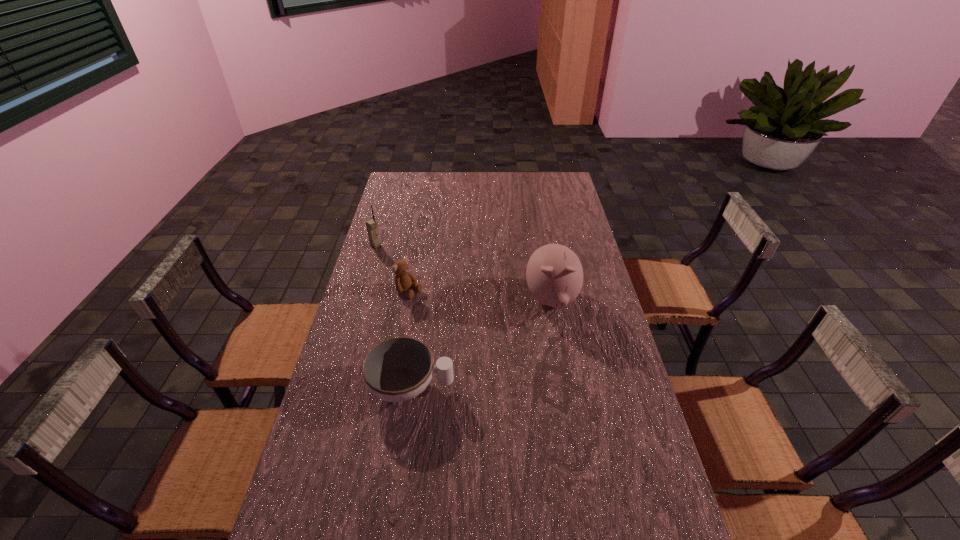
Where is `vacant space at the left edge`? The height and width of the screenshot is (540, 960). vacant space at the left edge is located at coordinates (354, 373).

This screenshot has width=960, height=540. I want to click on vacant area at the right edge of the desktop, so click(564, 226).

This screenshot has height=540, width=960. In the image, there is a desktop. Find the location of `vacant space at the far left corner`. vacant space at the far left corner is located at coordinates (395, 179).

Identify the location of free region at the near right corner of the desktop. This screenshot has width=960, height=540. (672, 526).

You are a GUI agent. You are given a task and a screenshot of the screen. Output one action in this format:
    pyautogui.click(x=<x>, y=<y>)
    Task: Click on the empty space between the rightmost object and the chinaware
    
    Given the screenshot: What is the action you would take?
    pyautogui.click(x=481, y=343)

Find the location of a particular element. empty space that is in between the rightmost object and the teddy bear is located at coordinates point(480,296).

You are a GUI agent. You are given a task and a screenshot of the screen. Output one action in this format:
    pyautogui.click(x=<x>, y=<y>)
    Task: Click on the free space between the rightmost object and the teddy bear
    Image resolution: width=960 pixels, height=540 pixels.
    Given the screenshot: What is the action you would take?
    pyautogui.click(x=480, y=296)

The height and width of the screenshot is (540, 960). Find the location of `empty location between the cellular telephone and the rightmost object`. empty location between the cellular telephone and the rightmost object is located at coordinates (464, 272).

Identify the location of vacant region between the rightmost object and the cellular telephone. (464, 272).

I want to click on vacant area that lies between the rightmost object and the nearest object, so click(481, 343).